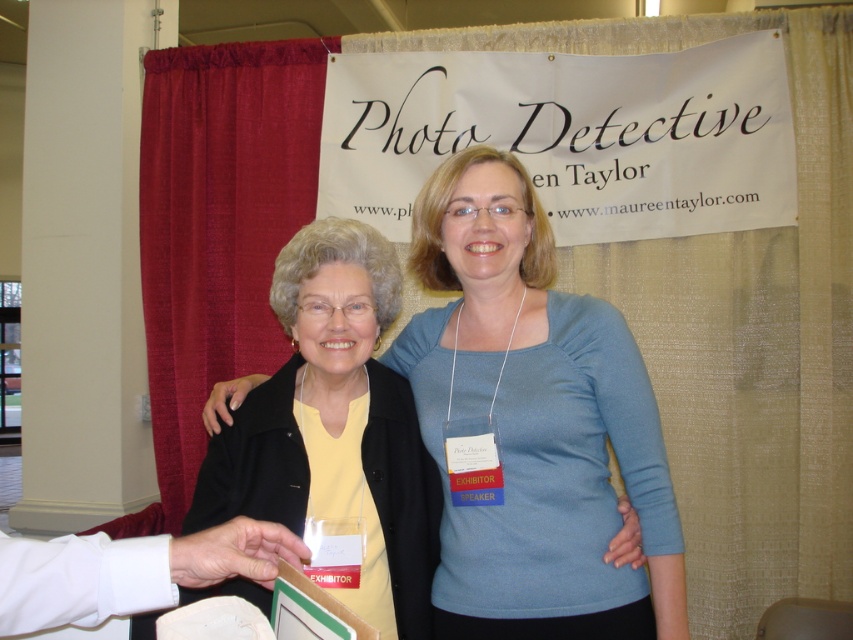
Question: Does matte yellow shirt at center appear under smooth white skin at lower left?

Choices:
 (A) no
 (B) yes

Answer: (A)

Question: Is matte yellow shirt at center below smooth white skin at lower left?

Choices:
 (A) no
 (B) yes

Answer: (A)

Question: Is matte yellow shirt at center to the left of smooth white skin at lower left from the viewer's perspective?

Choices:
 (A) yes
 (B) no

Answer: (B)